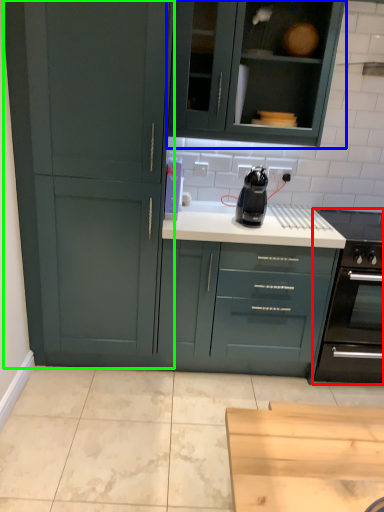
Question: Which is farther away from home appliance (highlighted by a red box)? cabinetry (highlighted by a blue box) or cupboard (highlighted by a green box)?

Choices:
 (A) cabinetry
 (B) cupboard

Answer: (B)